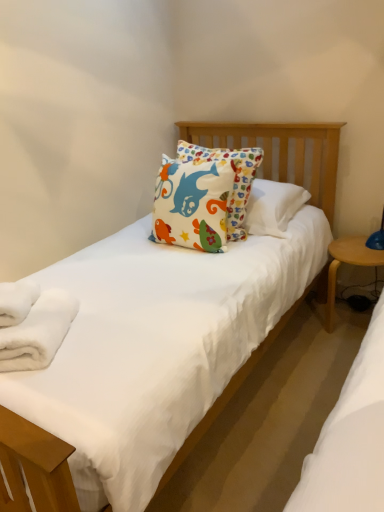
The height and width of the screenshot is (512, 384). Identify the location of white fluffy bath towel at lower left, which is counted as the 1th bath towel, starting from the bottom. tap(32, 324).

Is there a large distance between white fluffy bath towel at lower left, which is counted as the 1th bath towel, starting from the bottom, and white soft towel at lower left, positioned as the 1th bath towel in top-to-bottom order?

white fluffy bath towel at lower left, which is counted as the 1th bath towel, starting from the bottom, is near white soft towel at lower left, positioned as the 1th bath towel in top-to-bottom order, not far away.

Considering the positions of objects white fluffy bath towel at lower left, placed as the second bath towel when sorted from top to bottom, and white soft towel at lower left, positioned as the 1th bath towel in top-to-bottom order, in the image provided, who is behind, white fluffy bath towel at lower left, placed as the second bath towel when sorted from top to bottom, or white soft towel at lower left, positioned as the 1th bath towel in top-to-bottom order,?

Positioned behind is white soft towel at lower left, positioned as the 1th bath towel in top-to-bottom order.

Could you tell me if white fluffy bath towel at lower left, placed as the second bath towel when sorted from top to bottom, is facing white soft towel at lower left, the 2th bath towel when ordered from bottom to top?

No, white fluffy bath towel at lower left, placed as the second bath towel when sorted from top to bottom, is not oriented towards white soft towel at lower left, the 2th bath towel when ordered from bottom to top.

Is light wood/wooden table at right wider or thinner than white soft towel at lower left, positioned as the 1th bath towel in top-to-bottom order?

light wood/wooden table at right is wider than white soft towel at lower left, positioned as the 1th bath towel in top-to-bottom order.

Is white soft towel at lower left, positioned as the 1th bath towel in top-to-bottom order, at the back of light wood/wooden table at right?

No, light wood/wooden table at right's orientation is not away from white soft towel at lower left, positioned as the 1th bath towel in top-to-bottom order.

How many degrees apart are the facing directions of light wood/wooden table at right and white soft towel at lower left, positioned as the 1th bath towel in top-to-bottom order?

23.3 degrees.

In the scene shown: From a real-world perspective, is light wood/wooden table at right physically above white soft towel at lower left, positioned as the 1th bath towel in top-to-bottom order?

Actually, light wood/wooden table at right is physically below white soft towel at lower left, positioned as the 1th bath towel in top-to-bottom order, in the real world.

Is white fluffy bath towel at lower left, placed as the second bath towel when sorted from top to bottom, with light wood/wooden table at right?

white fluffy bath towel at lower left, placed as the second bath towel when sorted from top to bottom, and light wood/wooden table at right are clearly separated.

Which is further, (29,336) or (333,293)?

The point (333,293) is farther from the camera.

Can you tell me how much white fluffy bath towel at lower left, which is counted as the 1th bath towel, starting from the bottom, and light wood/wooden table at right differ in facing direction?

white fluffy bath towel at lower left, which is counted as the 1th bath towel, starting from the bottom, and light wood/wooden table at right are facing 23.3 degrees away from each other.

Considering the sizes of light wood/wooden table at right and white fluffy bath towel at lower left, placed as the second bath towel when sorted from top to bottom, in the image, is light wood/wooden table at right bigger or smaller than white fluffy bath towel at lower left, placed as the second bath towel when sorted from top to bottom,?

In the image, light wood/wooden table at right appears to be larger than white fluffy bath towel at lower left, placed as the second bath towel when sorted from top to bottom.

Looking at this image, is the position of light wood/wooden table at right more distant than that of white fluffy bath towel at lower left, placed as the second bath towel when sorted from top to bottom?

Yes, the depth of light wood/wooden table at right is greater than that of white fluffy bath towel at lower left, placed as the second bath towel when sorted from top to bottom.

From a real-world perspective, is light wood/wooden table at right located higher than white fluffy bath towel at lower left, which is counted as the 1th bath towel, starting from the bottom?

Incorrect, from a real-world perspective, light wood/wooden table at right is lower than white fluffy bath towel at lower left, which is counted as the 1th bath towel, starting from the bottom.

Is light wood/wooden table at right far from white fluffy bath towel at lower left, placed as the second bath towel when sorted from top to bottom?

light wood/wooden table at right is positioned a significant distance from white fluffy bath towel at lower left, placed as the second bath towel when sorted from top to bottom.

Is white soft towel at lower left, the 2th bath towel when ordered from bottom to top, positioned far away from white fluffy bath towel at lower left, placed as the second bath towel when sorted from top to bottom?

They are positioned close to each other.

Considering the positions of points (8, 298) and (28, 367), is point (8, 298) farther from camera compared to point (28, 367)?

Yes, it is.

From a real-world perspective, which is physically below, white soft towel at lower left, the 2th bath towel when ordered from bottom to top, or white fluffy bath towel at lower left, which is counted as the 1th bath towel, starting from the bottom?

In real-world perspective, white fluffy bath towel at lower left, which is counted as the 1th bath towel, starting from the bottom, is lower.

Who is taller, white soft towel at lower left, the 2th bath towel when ordered from bottom to top, or white fluffy bath towel at lower left, which is counted as the 1th bath towel, starting from the bottom?

Standing taller between the two is white fluffy bath towel at lower left, which is counted as the 1th bath towel, starting from the bottom.

Which object is thinner, white soft towel at lower left, the 2th bath towel when ordered from bottom to top, or light wood/wooden table at right?

white soft towel at lower left, the 2th bath towel when ordered from bottom to top, is thinner.

Is white soft towel at lower left, the 2th bath towel when ordered from bottom to top, positioned before light wood/wooden table at right?

Yes.

Is white soft towel at lower left, the 2th bath towel when ordered from bottom to top, looking in the opposite direction of light wood/wooden table at right?

No, white soft towel at lower left, the 2th bath towel when ordered from bottom to top, is not facing the opposite direction of light wood/wooden table at right.

From the image's perspective, between white soft towel at lower left, positioned as the 1th bath towel in top-to-bottom order, and light wood/wooden table at right, who is located below?

light wood/wooden table at right, from the image's perspective.

Find the location of `bath towel above the white fluffy bath towel at lower left, which is counted as the 1th bath towel, starting from the bottom (from the image's perspective)`. bath towel above the white fluffy bath towel at lower left, which is counted as the 1th bath towel, starting from the bottom (from the image's perspective) is located at coordinates (17, 301).

This screenshot has width=384, height=512. Find the location of `table that appears below the white soft towel at lower left, positioned as the 1th bath towel in top-to-bottom order (from a real-world perspective)`. table that appears below the white soft towel at lower left, positioned as the 1th bath towel in top-to-bottom order (from a real-world perspective) is located at coordinates (347, 263).

From the image, which object appears to be nearer to white fluffy bath towel at lower left, which is counted as the 1th bath towel, starting from the bottom, light wood/wooden table at right or white soft towel at lower left, positioned as the 1th bath towel in top-to-bottom order?

Result: Based on the image, white soft towel at lower left, positioned as the 1th bath towel in top-to-bottom order, appears to be nearer to white fluffy bath towel at lower left, which is counted as the 1th bath towel, starting from the bottom.

When comparing their distances from light wood/wooden table at right, does white fluffy bath towel at lower left, placed as the second bath towel when sorted from top to bottom, or white soft towel at lower left, the 2th bath towel when ordered from bottom to top, seem further?

white soft towel at lower left, the 2th bath towel when ordered from bottom to top, lies further to light wood/wooden table at right than the other object.

From the image, which object appears to be farther from white soft towel at lower left, the 2th bath towel when ordered from bottom to top, white fluffy bath towel at lower left, placed as the second bath towel when sorted from top to bottom, or light wood/wooden table at right?

light wood/wooden table at right is positioned further to the anchor white soft towel at lower left, the 2th bath towel when ordered from bottom to top.

From the image, which object appears to be farther from white fluffy bath towel at lower left, placed as the second bath towel when sorted from top to bottom, white soft towel at lower left, the 2th bath towel when ordered from bottom to top, or light wood/wooden table at right?

The object further to white fluffy bath towel at lower left, placed as the second bath towel when sorted from top to bottom, is light wood/wooden table at right.

Estimate the real-world distances between objects in this image. Which object is further from white soft towel at lower left, positioned as the 1th bath towel in top-to-bottom order, light wood/wooden table at right or white fluffy bath towel at lower left, placed as the second bath towel when sorted from top to bottom?

light wood/wooden table at right is positioned further to the anchor white soft towel at lower left, positioned as the 1th bath towel in top-to-bottom order.

Looking at this image, from the image, which object appears to be nearer to light wood/wooden table at right, white soft towel at lower left, positioned as the 1th bath towel in top-to-bottom order, or white fluffy bath towel at lower left, placed as the second bath towel when sorted from top to bottom?

The object closer to light wood/wooden table at right is white fluffy bath towel at lower left, placed as the second bath towel when sorted from top to bottom.

Identify the location of bath towel between white soft towel at lower left, positioned as the 1th bath towel in top-to-bottom order, and light wood/wooden table at right from left to right. This screenshot has width=384, height=512. (32, 324).